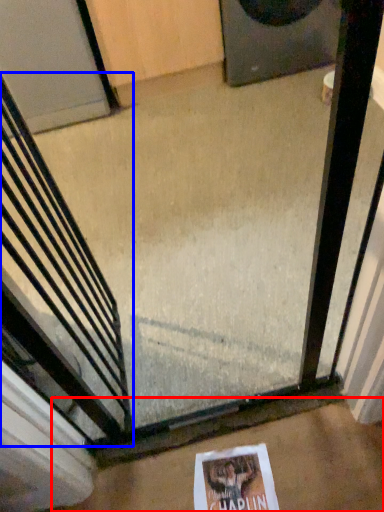
Question: Among these objects, which one is nearest to the camera, concrete (highlighted by a red box) or escalator (highlighted by a blue box)?

Choices:
 (A) concrete
 (B) escalator

Answer: (B)